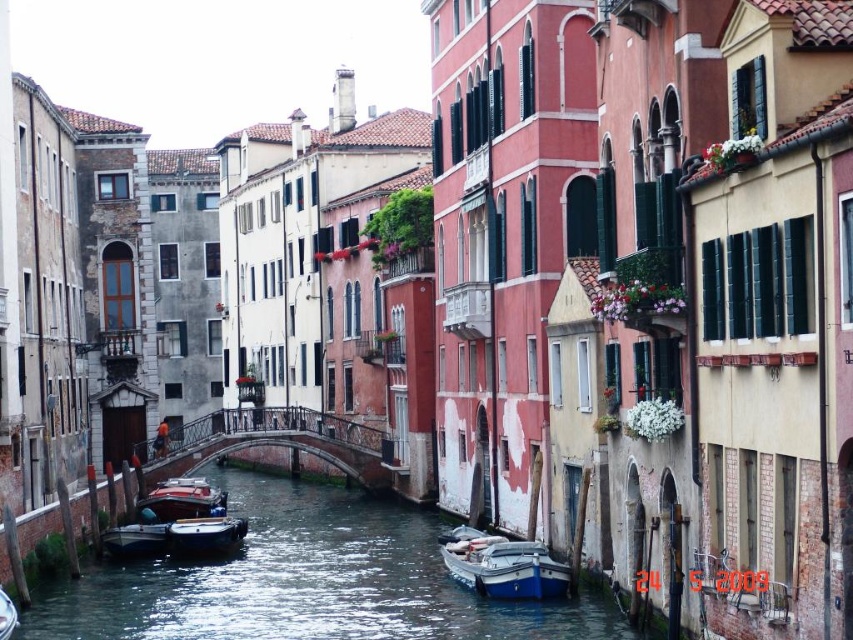
You are a tourist standing on the metallic bridge at center and want to take a photo of the clear water at center. In which direction should you point your camera?

The clear water at center is to the right of the metallic bridge at center, so you should point your camera to the right to capture the clear water at center.

You are a tourist standing at the edge of the canal in Venice. You want to take a photo of the clear water at center. Where should you position yourself to capture it in the best possible frame?

The clear water at center is located at the 2D coordinates point of (306,580), so you should position yourself directly facing that point to capture it in the best possible frame.